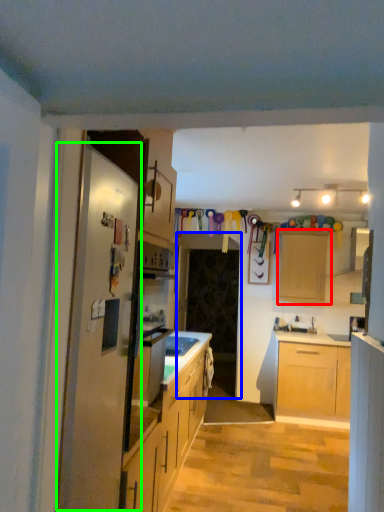
Question: Estimate the real-world distances between objects in this image. Which object is closer to cabinetry (highlighted by a red box), glass door (highlighted by a blue box) or fridge (highlighted by a green box)?

Choices:
 (A) glass door
 (B) fridge

Answer: (A)